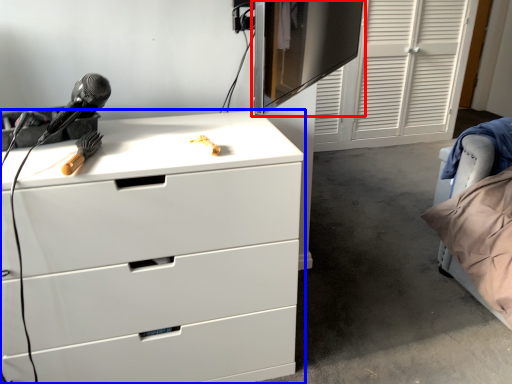
Question: Among these objects, which one is farthest to the camera, computer monitor (highlighted by a red box) or chest of drawers (highlighted by a blue box)?

Choices:
 (A) computer monitor
 (B) chest of drawers

Answer: (B)